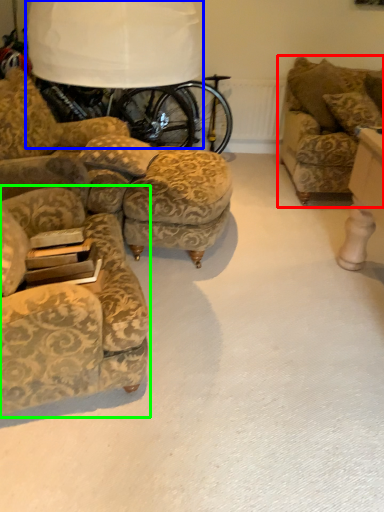
Question: Which is farther away from studio couch (highlighted by a red box)? table lamp (highlighted by a blue box) or chair (highlighted by a green box)?

Choices:
 (A) table lamp
 (B) chair

Answer: (B)